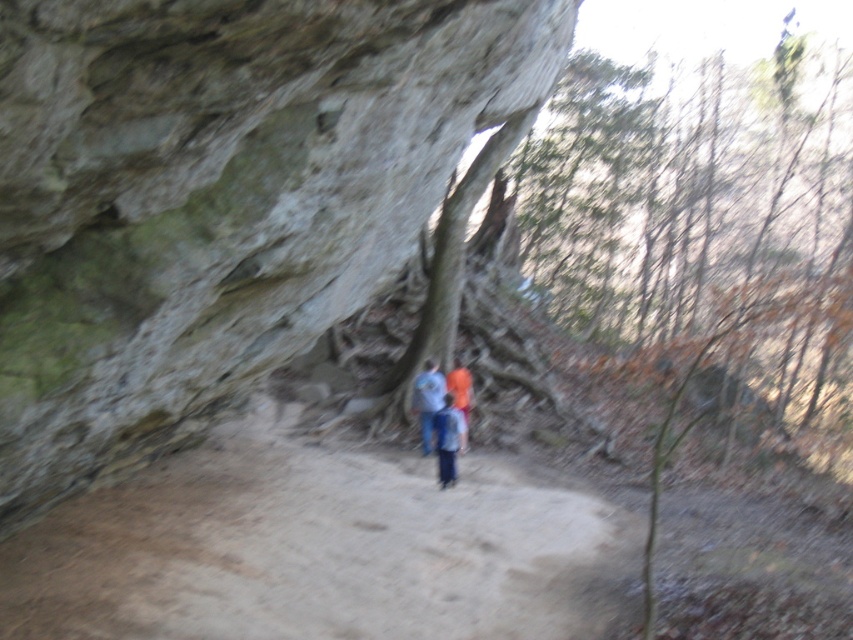
Question: Observing the image, what is the correct spatial positioning of blue denim jeans at center in reference to orange fabric at center?

Choices:
 (A) above
 (B) below

Answer: (B)

Question: Which point is closer to the camera taking this photo?

Choices:
 (A) (450, 396)
 (B) (256, 417)
 (C) (430, 406)
 (D) (451, 387)

Answer: (A)

Question: Does dirt path at center come behind blue fabric shirt at center?

Choices:
 (A) yes
 (B) no

Answer: (B)

Question: Which point is farther from the camera taking this photo?

Choices:
 (A) (412, 502)
 (B) (463, 403)

Answer: (B)

Question: Which object appears farthest from the camera in this image?

Choices:
 (A) dirt path at center
 (B) orange fabric at center
 (C) gray rough rock at center

Answer: (B)

Question: Can you confirm if gray rough rock at center is positioned to the right of blue denim jeans at center?

Choices:
 (A) no
 (B) yes

Answer: (A)